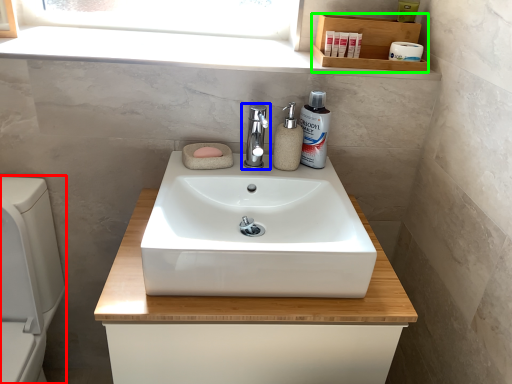
Question: Considering the real-world distances, which object is farthest from appliance (highlighted by a red box)? tap (highlighted by a blue box) or shelf (highlighted by a green box)?

Choices:
 (A) tap
 (B) shelf

Answer: (B)